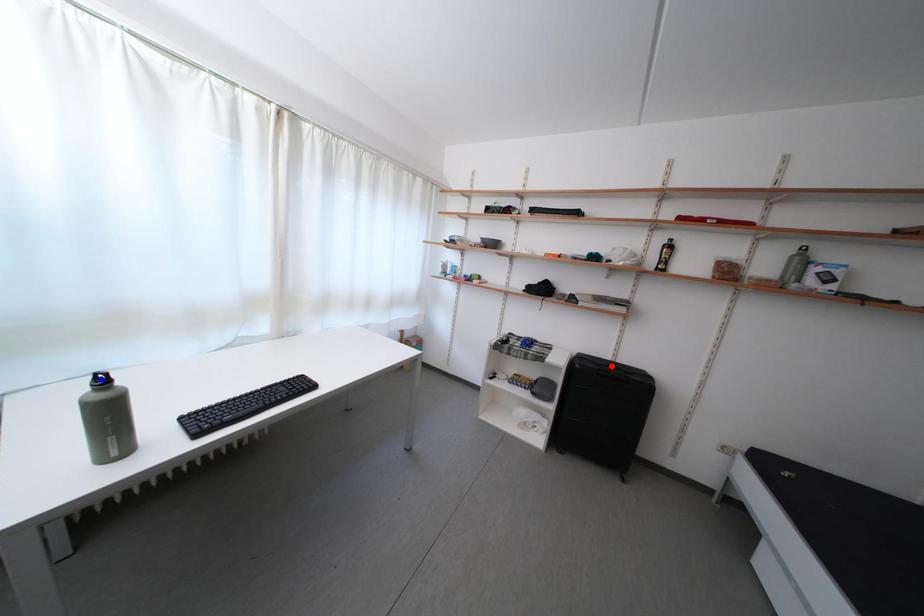
Question: Which of the two points in the image is closer to the camera?

Choices:
 (A) Blue point is closer.
 (B) Red point is closer.

Answer: (A)